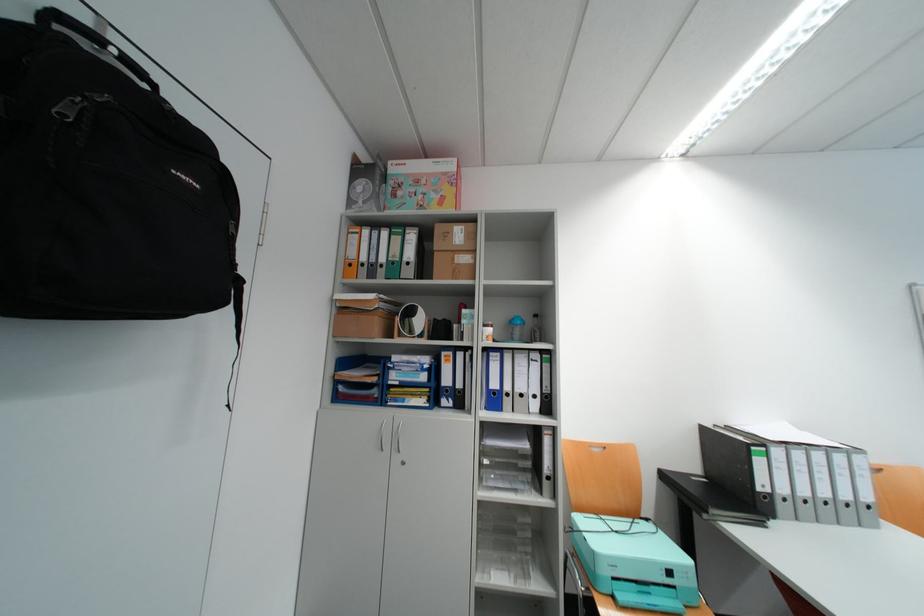
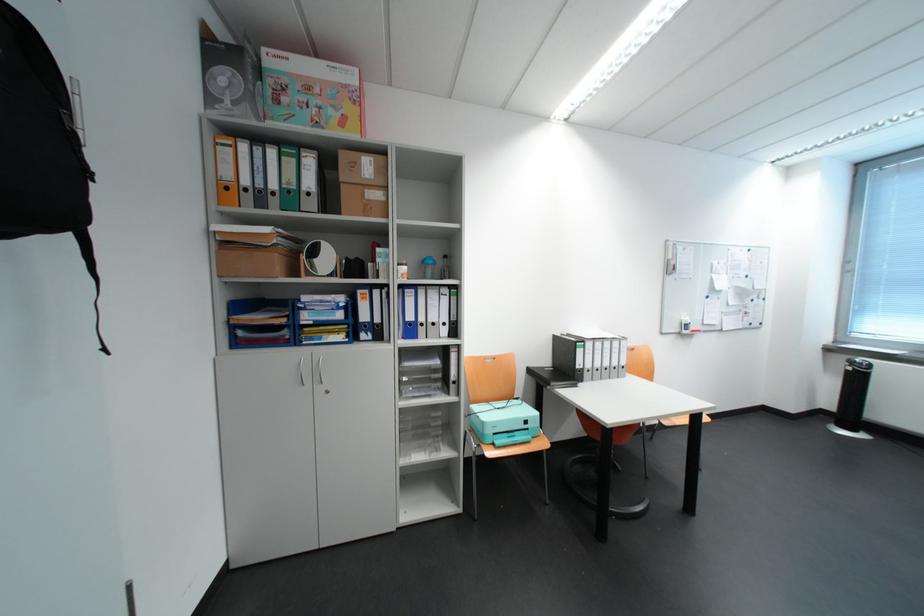
Locate, in the second image, the point that corresponds to [394,261] in the first image.

(285, 188)